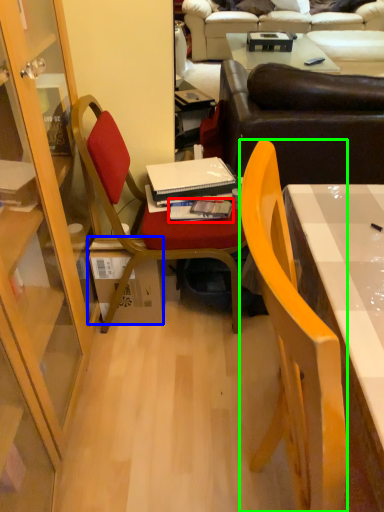
Question: Considering the real-world distances, which object is farthest from book (highlighted by a red box)? box (highlighted by a blue box) or chair (highlighted by a green box)?

Choices:
 (A) box
 (B) chair

Answer: (B)